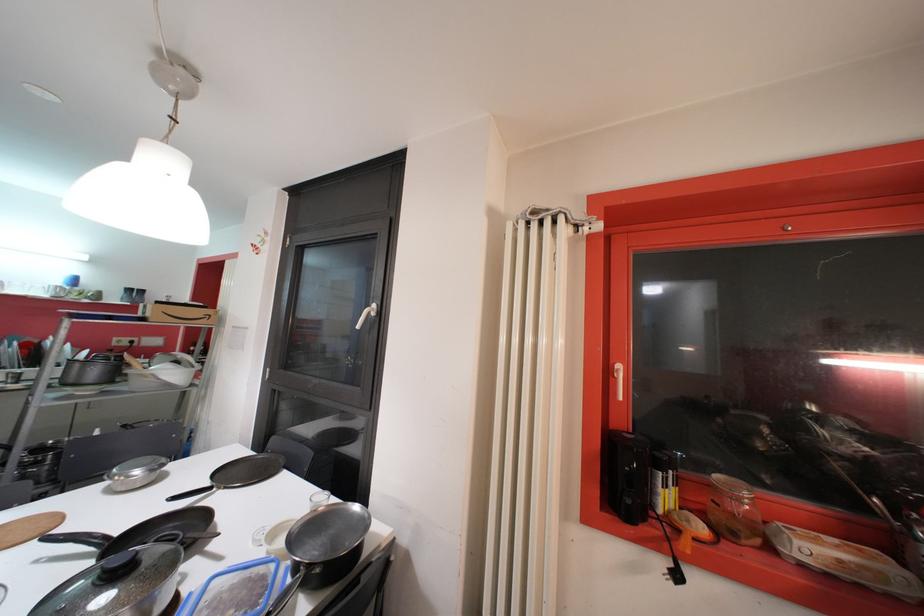
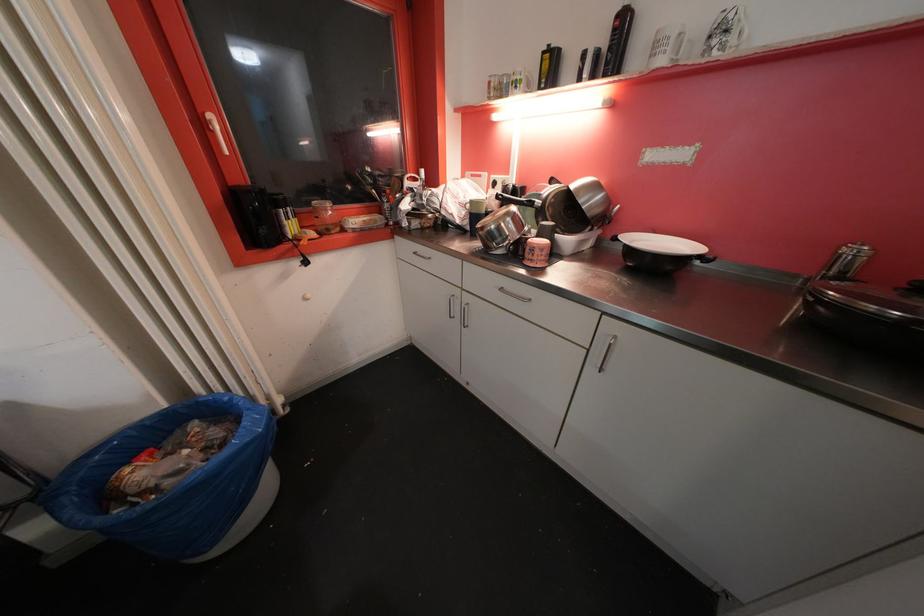
Where in the second image is the point corresponding to point (738, 536) from the first image?

(333, 233)